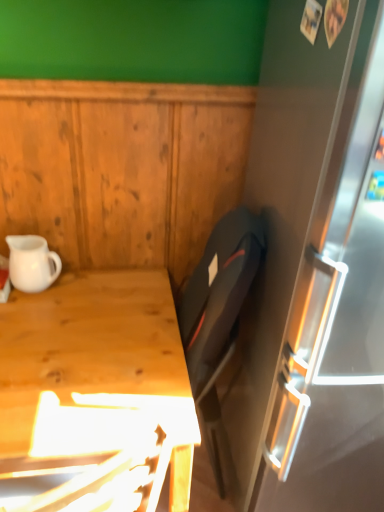
Locate an element on the screen. vacant area located to the right-hand side of white matte pitcher at left is located at coordinates (86, 284).